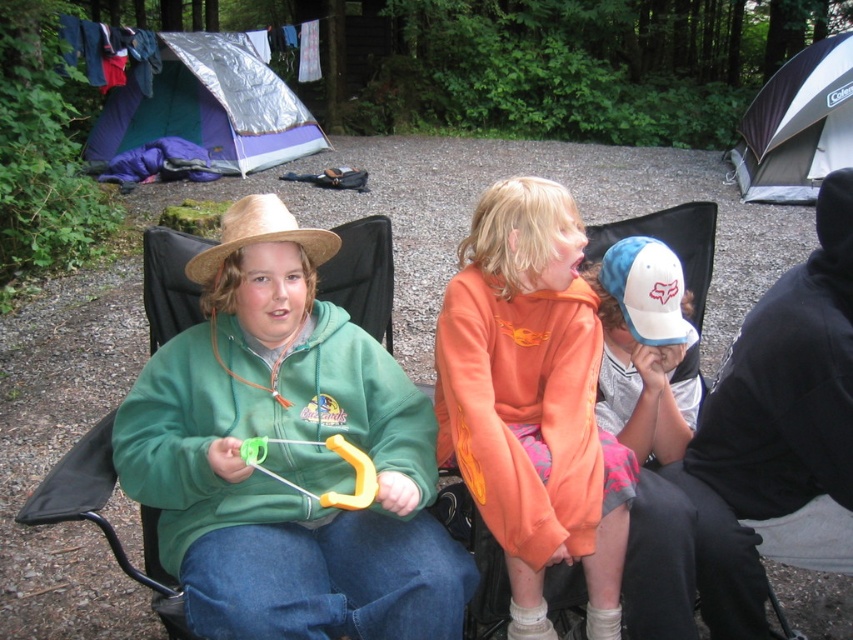
You are a camper who wants to set up a new tent between the blue tarp tent at upper left and the black and white canvas tent at upper right. Which tent should you place your new tent closer to if you want it to be closer to the foreground of the image?

You should place your new tent closer to the blue tarp tent at upper left because it is closer to the foreground than the black and white canvas tent at upper right.